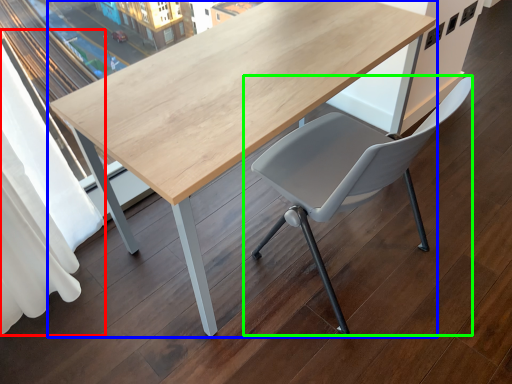
Question: Which object is positioned closest to curtain (highlighted by a red box)? Select from table (highlighted by a blue box) and chair (highlighted by a green box).

Choices:
 (A) table
 (B) chair

Answer: (A)